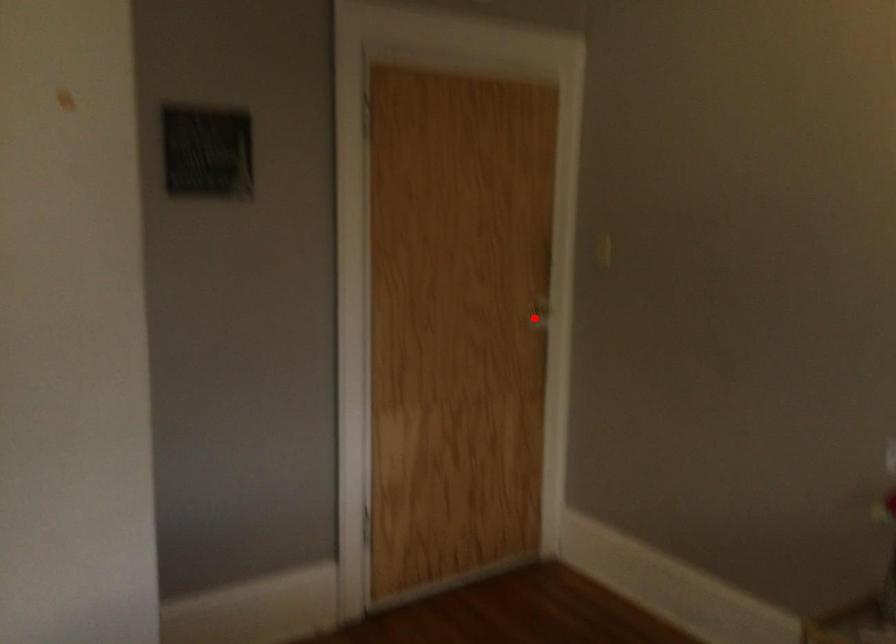
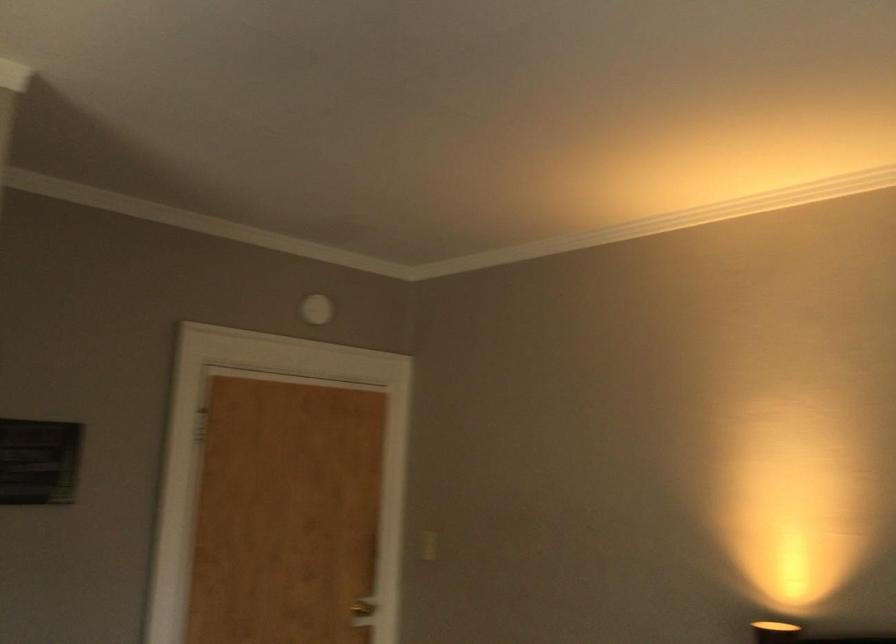
Find the pixel in the second image that matches the highlighted location in the first image.

(362, 612)